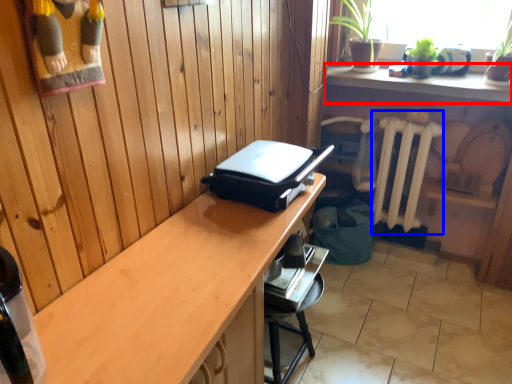
Question: Which object is closer to the camera taking this photo, shelf (highlighted by a red box) or radiator (highlighted by a blue box)?

Choices:
 (A) shelf
 (B) radiator

Answer: (A)